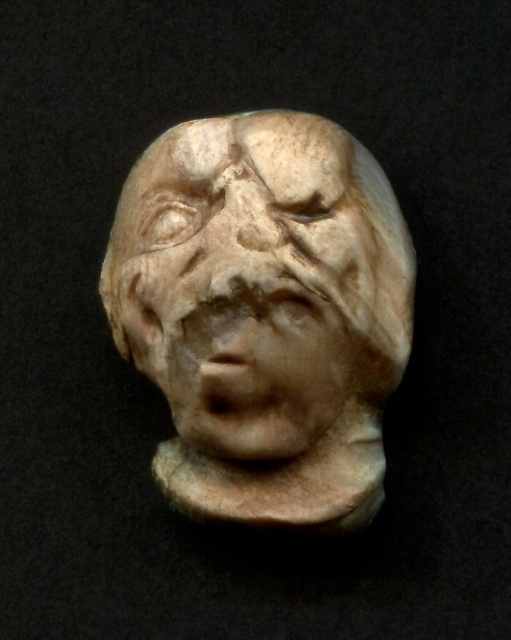
You are an art conservator examining the white marble head at center and the white marble face at center in the image. Which object has a greater width?

The white marble head at center has a greater width than the white marble face at center.

You are an archaeologist examining the ancient stone sculpture. You notice a specific point at coordinates (265, 314). What object does this point correspond to in the image?

The point at coordinates (265, 314) corresponds to the white marble head at center.

You are standing at a point 5 feet away from the sculpture. Can you see the point at coordinates point (246, 128) on the sculpture?

The distance of point (246, 128) from camera is 4.21 feet, so yes, you can see the point at coordinates point 0.200, 0.200 on the sculpture since you are standing 5 feet away from it, which is farther than the point.